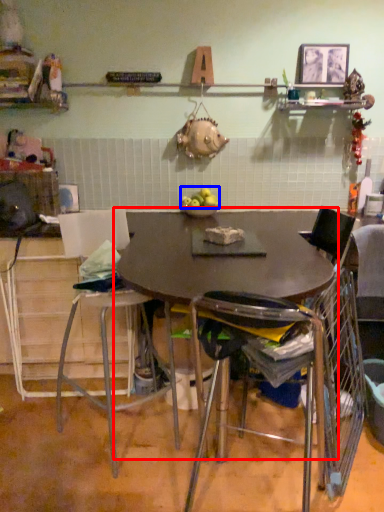
Question: Among these objects, which one is farthest to the camera, table (highlighted by a red box) or apple (highlighted by a blue box)?

Choices:
 (A) table
 (B) apple

Answer: (B)